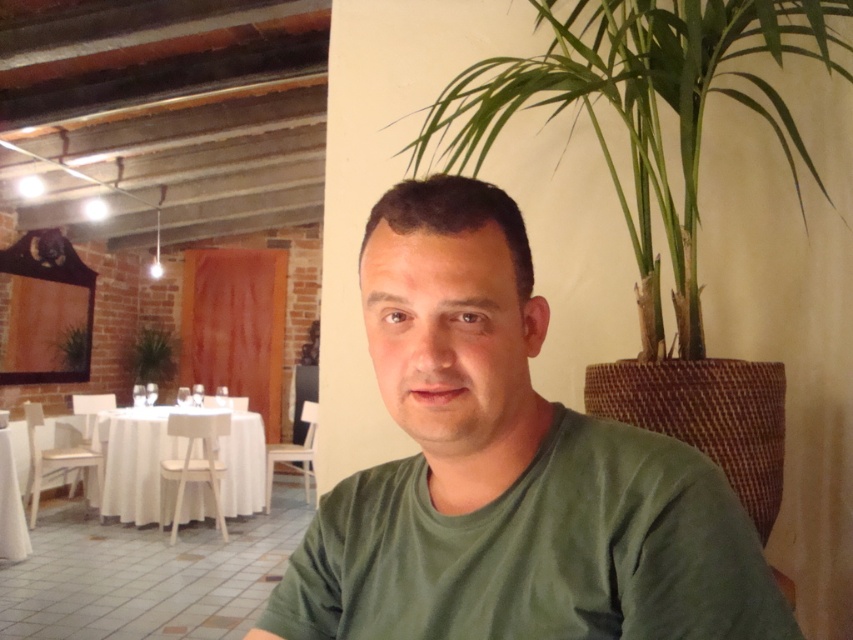
Is white fabric table at left taller than green leafy plant at center?

Indeed, white fabric table at left has a greater height compared to green leafy plant at center.

Between white fabric table at left and green leafy plant at center, which one is positioned lower?

white fabric table at left is lower down.

Who is more forward, (107, 461) or (169, 362)?

Point (107, 461) is in front.

The width and height of the screenshot is (853, 640). I want to click on white fabric table at left, so click(177, 456).

Which of these two, green leafy plant at center or green leafy plant at left, stands taller?

With more height is green leafy plant at center.

This screenshot has width=853, height=640. Describe the element at coordinates (152, 355) in the screenshot. I see `green leafy plant at center` at that location.

Does point (134, 374) come closer to viewer compared to point (57, 337)?

No, it is not.

Identify the location of green leafy plant at center. (152, 355).

Does green cotton shirt at center have a greater height compared to green leafy plant at center?

No.

Can you confirm if green cotton shirt at center is bigger than green leafy plant at center?

No, green cotton shirt at center is not bigger than green leafy plant at center.

Is point (294, 586) positioned after point (137, 378)?

No, it is in front of (137, 378).

This screenshot has height=640, width=853. I want to click on green cotton shirt at center, so click(508, 472).